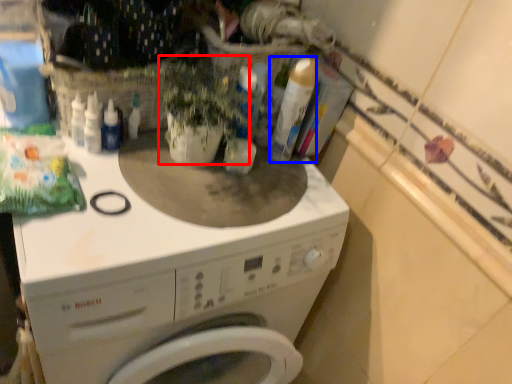
Question: Which object appears closest to the camera in this image, plant (highlighted by a red box) or cleaning product (highlighted by a blue box)?

Choices:
 (A) plant
 (B) cleaning product

Answer: (A)